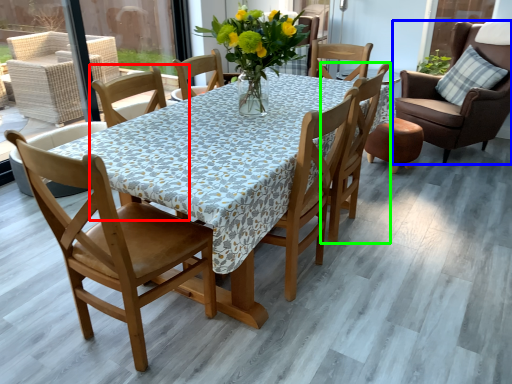
Question: Estimate the real-world distances between objects in this image. Which object is farther from chair (highlighted by a red box), chair (highlighted by a blue box) or chair (highlighted by a green box)?

Choices:
 (A) chair
 (B) chair

Answer: (A)